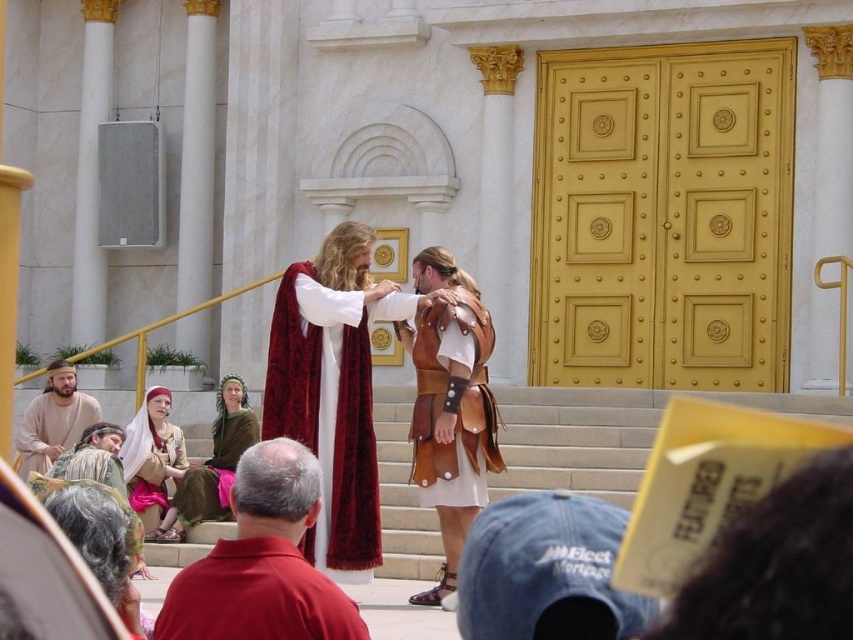
Is red leather sandals at lower center behind beige fabric robe at lower left?

That is False.

What do you see at coordinates (262, 563) in the screenshot?
I see `red leather sandals at lower center` at bounding box center [262, 563].

Find the location of `red leather sandals at lower center`. red leather sandals at lower center is located at coordinates (262, 563).

Is white fabric headscarf at lower left above velvet-like red robe at lower left?

No, white fabric headscarf at lower left is not above velvet-like red robe at lower left.

The width and height of the screenshot is (853, 640). Find the location of `white fabric headscarf at lower left`. white fabric headscarf at lower left is located at coordinates (152, 458).

Is point (166, 493) closer to camera compared to point (86, 465)?

No, it is behind (86, 465).

Where is `white fabric headscarf at lower left`? The image size is (853, 640). white fabric headscarf at lower left is located at coordinates (152, 458).

Measure the distance from velvet red robe at center to white fabric headscarf at lower left.

velvet red robe at center is 9.61 meters from white fabric headscarf at lower left.

What do you see at coordinates (329, 408) in the screenshot? This screenshot has width=853, height=640. I see `velvet red robe at center` at bounding box center [329, 408].

Locate an element on the screen. velvet red robe at center is located at coordinates (329, 408).